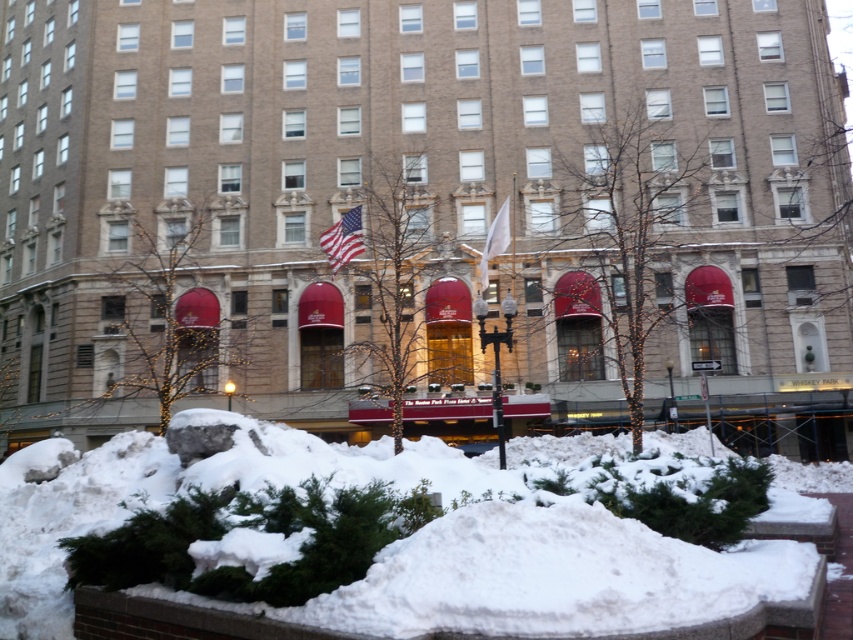
Question: Is white fluffy snow at lower center below white fabric flag at center?

Choices:
 (A) no
 (B) yes

Answer: (B)

Question: Is white fluffy snow at lower center wider than white fabric flag at center?

Choices:
 (A) yes
 (B) no

Answer: (A)

Question: Does white fluffy snow at lower center lie in front of american flag at center?

Choices:
 (A) no
 (B) yes

Answer: (B)

Question: Which object appears farthest from the camera in this image?

Choices:
 (A) brown brick building at center
 (B) american flag at center
 (C) white fabric flag at center

Answer: (B)

Question: Which point is farther to the camera?

Choices:
 (A) white fluffy snow at lower center
 (B) brown brick building at center
 (C) white fabric flag at center

Answer: (C)

Question: Among these objects, which one is nearest to the camera?

Choices:
 (A) american flag at center
 (B) white fabric flag at center
 (C) white fluffy snow at lower center
 (D) brown brick building at center

Answer: (C)